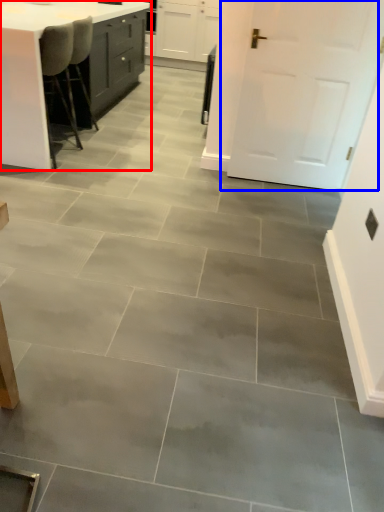
Question: Which object is closer to the camera taking this photo, table (highlighted by a red box) or door (highlighted by a blue box)?

Choices:
 (A) table
 (B) door

Answer: (B)